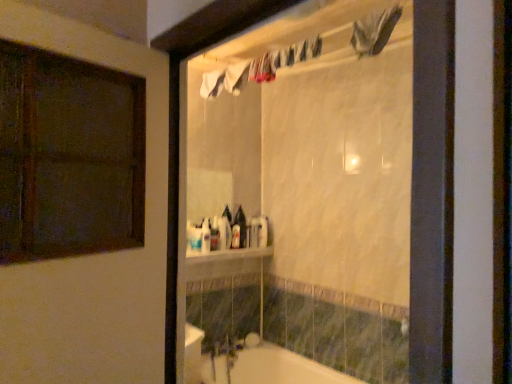
Question: Considering the positions of point (266, 228) and point (238, 241), is point (266, 228) closer or farther from the camera than point (238, 241)?

Choices:
 (A) closer
 (B) farther

Answer: (B)

Question: Would you say white glossy bottle at center, which is counted as the 5th toiletry, starting from the left, is inside or outside white plastic bottle at center, acting as the 3th toiletry starting from the back?

Choices:
 (A) inside
 (B) outside

Answer: (B)

Question: Estimate the real-world distances between objects in this image. Which object is farther from the translucent plastic container at center, the second toiletry when ordered from back to front?

Choices:
 (A) white glossy bathtub at lower center
 (B) white glossy bottle at center, placed as the fifth toiletry when sorted from right to left
 (C) white glossy mirror at upper center
 (D) white glossy shelf at center
 (E) white glossy bottle at center, which is counted as the 5th toiletry, starting from the left

Answer: (A)

Question: Estimate the real-world distances between objects in this image. Which object is closer to the white glossy shelf at center?

Choices:
 (A) white glossy bathtub at lower center
 (B) translucent plastic container at center, the 4th toiletry when ordered from left to right
 (C) white glossy bottle at center, which appears as the fifth toiletry when viewed from the front
 (D) translucent plastic bottle at upper center, the second toiletry viewed from the left
 (E) white plastic bottle at center, arranged as the third toiletry when viewed from the front

Answer: (D)